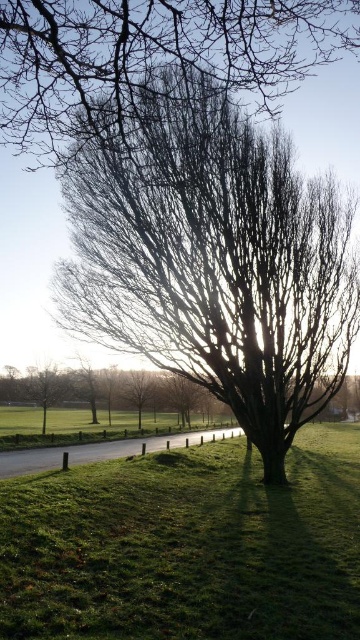
You are a hiker trying to decide which tree to climb. You see the green matte tree at lower left and the smooth bark tree at center. Which tree is shorter and better suited for a quick climb?

The green matte tree at lower left is shorter than the smooth bark tree at center, making it better suited for a quick climb.

You are standing at the center of the image. Looking at the bare branches at center, can you tell me their exact 2D coordinates?

The 2D coordinates of the bare branches at center are at point (213,257).